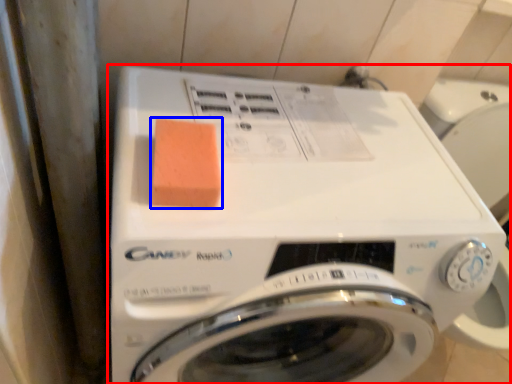
Question: Which object appears farthest to the camera in this image, washing machine (highlighted by a red box) or food (highlighted by a blue box)?

Choices:
 (A) washing machine
 (B) food

Answer: (B)